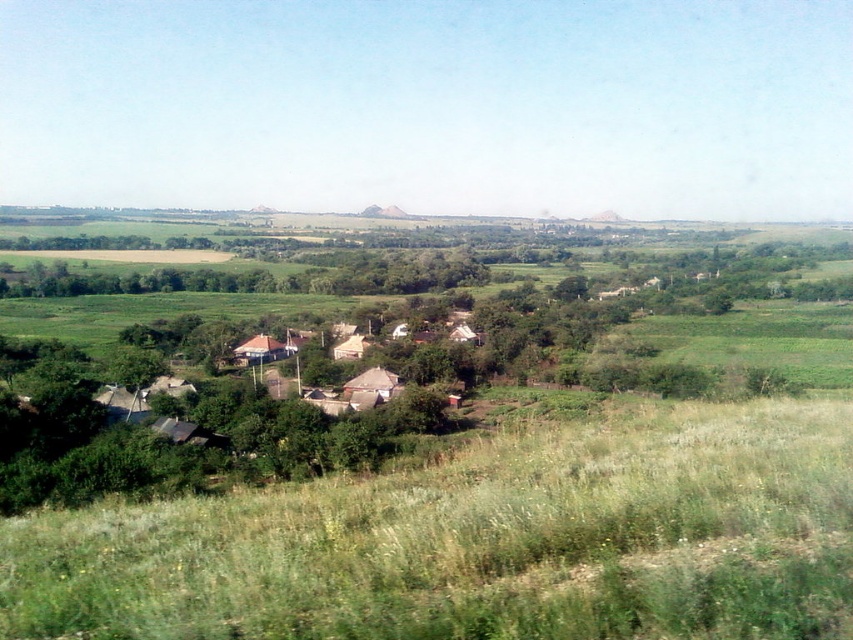
Question: Which point appears closest to the camera in this image?

Choices:
 (A) (732, 566)
 (B) (676, 337)

Answer: (A)

Question: Is green grassy field at lower center closer to camera compared to green grassy field at right?

Choices:
 (A) no
 (B) yes

Answer: (B)

Question: Considering the relative positions of green grassy field at lower center and green grassy field at right in the image provided, where is green grassy field at lower center located with respect to green grassy field at right?

Choices:
 (A) right
 (B) left

Answer: (B)

Question: Is green grassy field at lower center wider than green grassy field at right?

Choices:
 (A) yes
 (B) no

Answer: (B)